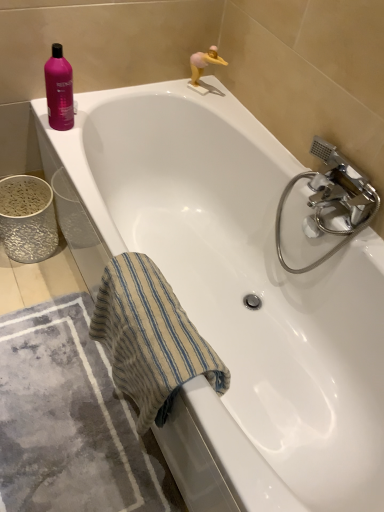
Identify the location of vacant space situated above chrome metallic faucet at right (from a real-world perspective). The width and height of the screenshot is (384, 512). (352, 160).